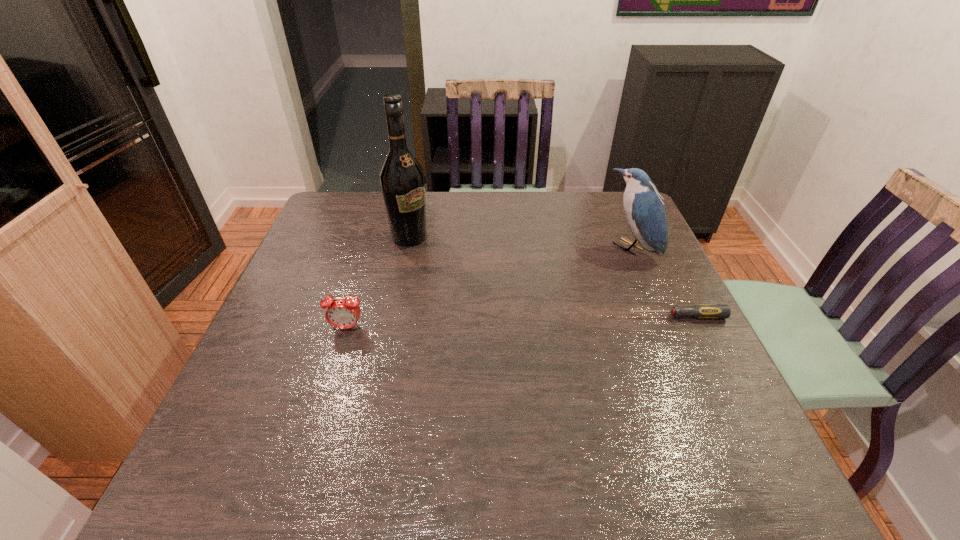
The image size is (960, 540). I want to click on vacant space located at the tip of the second tallest object's beak, so click(x=569, y=292).

I want to click on free spot located 0.190m at the tip of the second tallest object's beak, so click(572, 289).

Locate an element on the screen. This screenshot has width=960, height=540. vacant space located at the tip of the second tallest object's beak is located at coordinates (525, 321).

This screenshot has height=540, width=960. Identify the location of free space located on the label of the tallest object. (519, 309).

The image size is (960, 540). I want to click on blank space located 0.400m on the label of the tallest object, so click(529, 315).

At what (x,y) coordinates should I click in order to perform the action: click on vacant space situated 0.080m on the label of the tallest object. Please return your answer as a coordinate pair (x, y). This screenshot has width=960, height=540. Looking at the image, I should click on (441, 258).

Identify the location of bird situated at the far edge. This screenshot has width=960, height=540. (644, 209).

This screenshot has width=960, height=540. I want to click on wine bottle present at the far edge, so click(402, 180).

At what (x,y) coordinates should I click in order to perform the action: click on object located in the left edge section of the desktop. Please return your answer as a coordinate pair (x, y). The height and width of the screenshot is (540, 960). Looking at the image, I should click on (341, 313).

The width and height of the screenshot is (960, 540). I want to click on screwdriver that is positioned at the right edge, so click(701, 311).